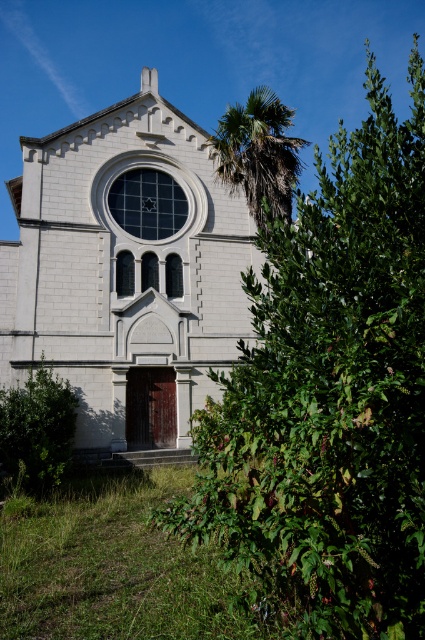
Question: Is green leafy bush at center smaller than white stone church at center?

Choices:
 (A) no
 (B) yes

Answer: (A)

Question: Which object is positioned closest to the green leafy bush at center?

Choices:
 (A) green leafy bush at lower left
 (B) white stone church at center

Answer: (A)

Question: Estimate the real-world distances between objects in this image. Which object is closer to the green leafy bush at lower left?

Choices:
 (A) white stone church at center
 (B) green leafy bush at center

Answer: (A)

Question: Is green leafy bush at center closer to the viewer compared to green leafy palm at upper center?

Choices:
 (A) yes
 (B) no

Answer: (A)

Question: Which of the following is the farthest from the observer?

Choices:
 (A) (288, 177)
 (B) (243, 436)
 (C) (198, 326)

Answer: (C)

Question: Does green leafy bush at center appear over white stone church at center?

Choices:
 (A) yes
 (B) no

Answer: (A)